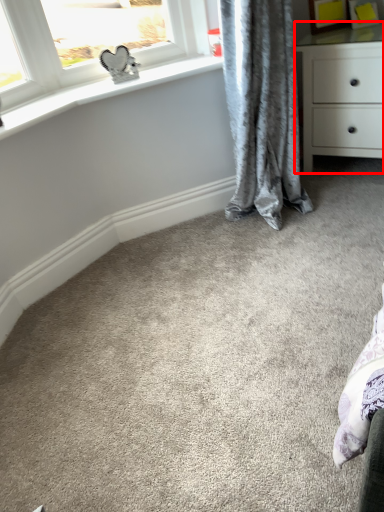
Question: Considering the relative positions of chest of drawers (annotated by the red box) and curtain in the image provided, where is chest of drawers (annotated by the red box) located with respect to the staircase?

Choices:
 (A) left
 (B) right

Answer: (B)